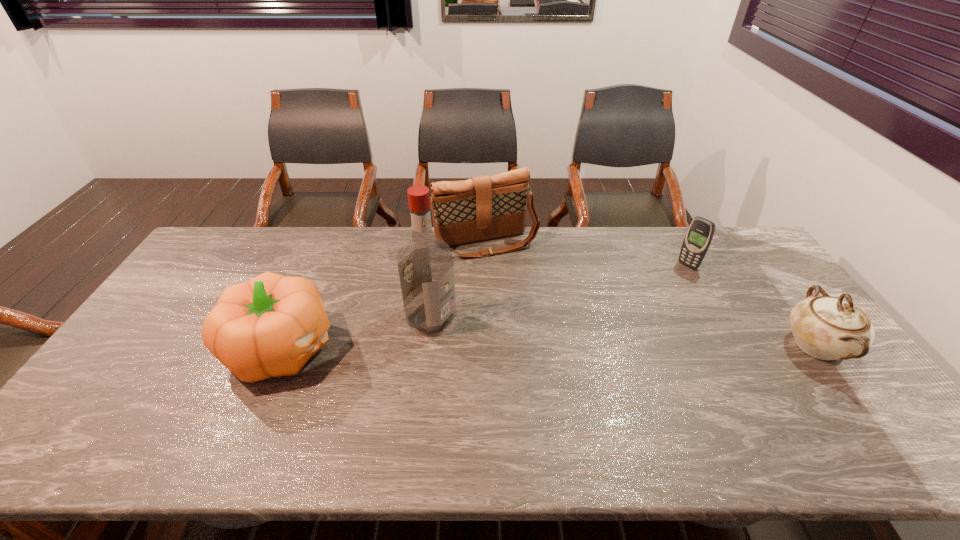
Find the location of `free space on the desktop that is between the pumpkin and the chinaware and is positioned on the front-facing side of the liquor`. free space on the desktop that is between the pumpkin and the chinaware and is positioned on the front-facing side of the liquor is located at coordinates (492, 347).

The image size is (960, 540). Identify the location of vacant space on the desktop that is between the leftmost object and the chinaware and is positioned on the front-facing side of the shoulder bag. (540, 347).

Where is `vacant space on the desktop that is between the leftmost object and the chinaware and is positioned on the screen of the cellular telephone`? The height and width of the screenshot is (540, 960). vacant space on the desktop that is between the leftmost object and the chinaware and is positioned on the screen of the cellular telephone is located at coordinates (580, 347).